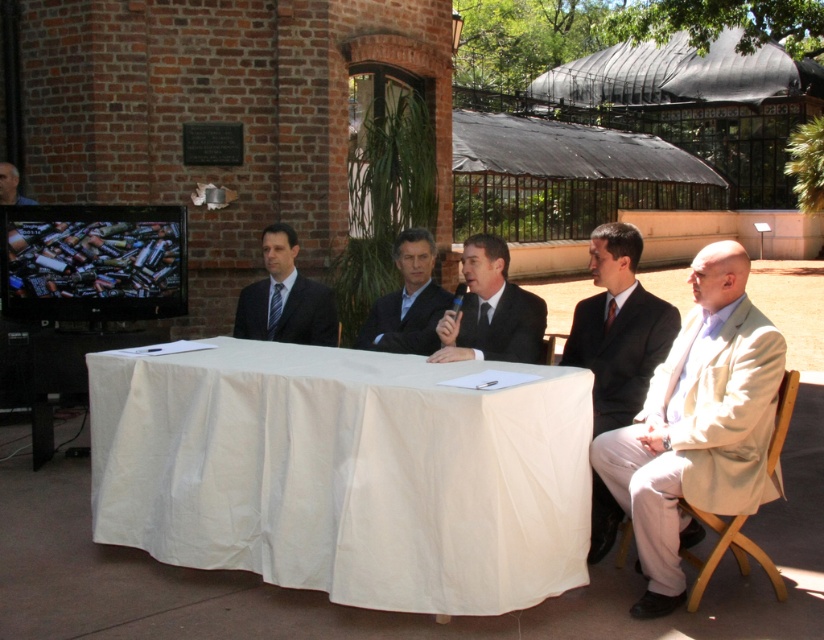
Question: Does black matte suit at right appear on the right side of dark blue suit at center?

Choices:
 (A) no
 (B) yes

Answer: (B)

Question: Which of these objects is positioned farthest from the black suit at center?

Choices:
 (A) white cloth-covered table at center
 (B) beige fabric suit at right
 (C) dark suit at center

Answer: (A)

Question: Which is farther from the beige fabric suit at right?

Choices:
 (A) dark suit at center
 (B) white cloth-covered table at center
 (C) smooth black suit at upper left

Answer: (C)

Question: Is black suit at center further to the viewer compared to black suit at left?

Choices:
 (A) no
 (B) yes

Answer: (A)

Question: Is the position of dark blue suit at center more distant than that of smooth black suit at upper left?

Choices:
 (A) yes
 (B) no

Answer: (B)

Question: Among these objects, which one is nearest to the camera?

Choices:
 (A) beige fabric suit at right
 (B) black suit at center

Answer: (A)